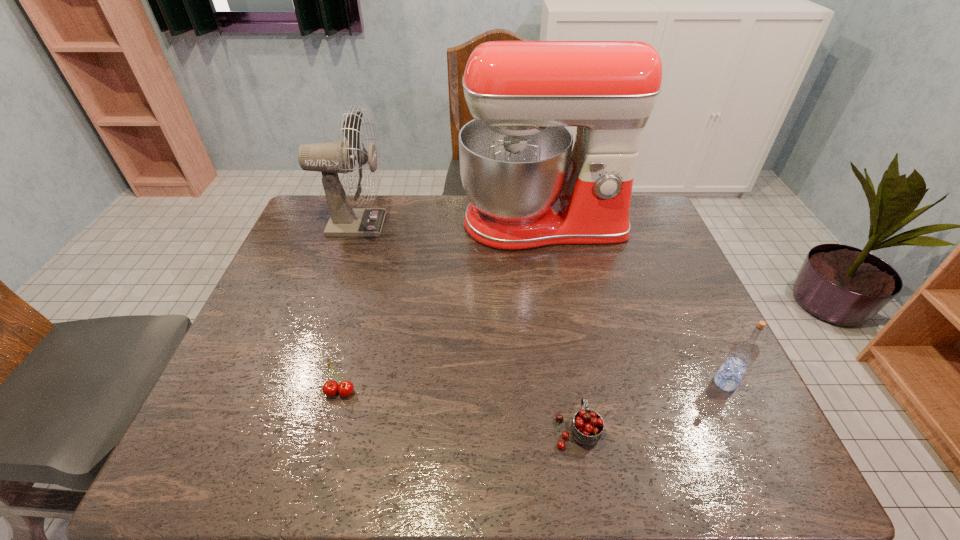
Identify the location of object that is at the far left corner. Image resolution: width=960 pixels, height=540 pixels. (331, 158).

At what (x,y) coordinates should I click in order to perform the action: click on object located at the far right corner. Please return your answer as a coordinate pair (x, y). The height and width of the screenshot is (540, 960). Looking at the image, I should click on (528, 188).

Find the location of a particular element. The image size is (960, 540). vacant position at the far edge of the desktop is located at coordinates (375, 198).

Find the location of a particular element. vacant space at the near edge of the desktop is located at coordinates (360, 439).

This screenshot has width=960, height=540. I want to click on vacant space at the left edge of the desktop, so click(289, 316).

Image resolution: width=960 pixels, height=540 pixels. In the image, there is a desktop. What are the coordinates of `vacant space at the right edge` in the screenshot? It's located at (692, 300).

Image resolution: width=960 pixels, height=540 pixels. I want to click on vacant space at the near left corner of the desktop, so 223,472.

Where is `empty space that is in between the left cherry and the nearest object`? Image resolution: width=960 pixels, height=540 pixels. empty space that is in between the left cherry and the nearest object is located at coordinates (458, 411).

At what (x,y) coordinates should I click in order to perform the action: click on free space between the mixer and the right cherry. Please return your answer as a coordinate pair (x, y). The width and height of the screenshot is (960, 540). Looking at the image, I should click on (560, 327).

Where is `free space between the nearest object and the mixer`? This screenshot has height=540, width=960. free space between the nearest object and the mixer is located at coordinates (560, 327).